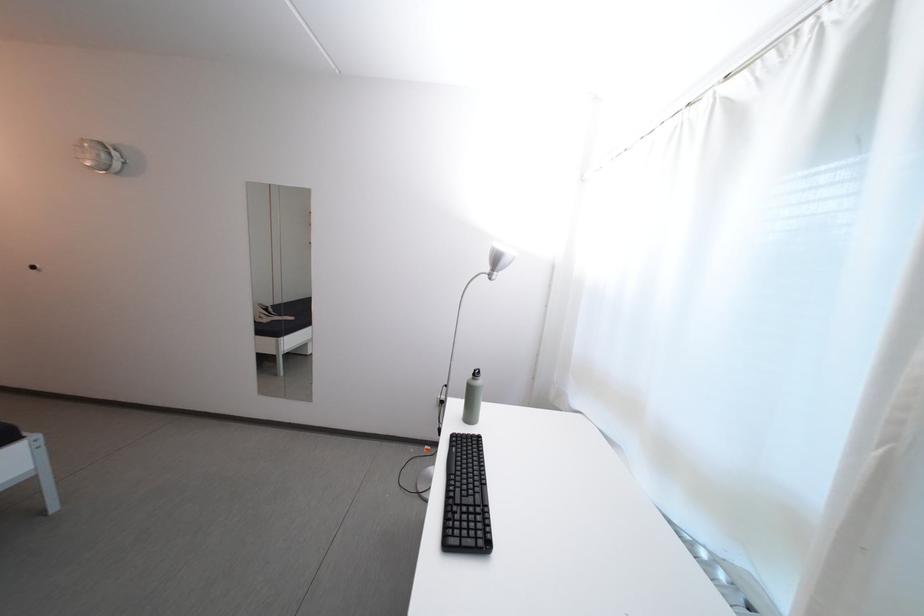
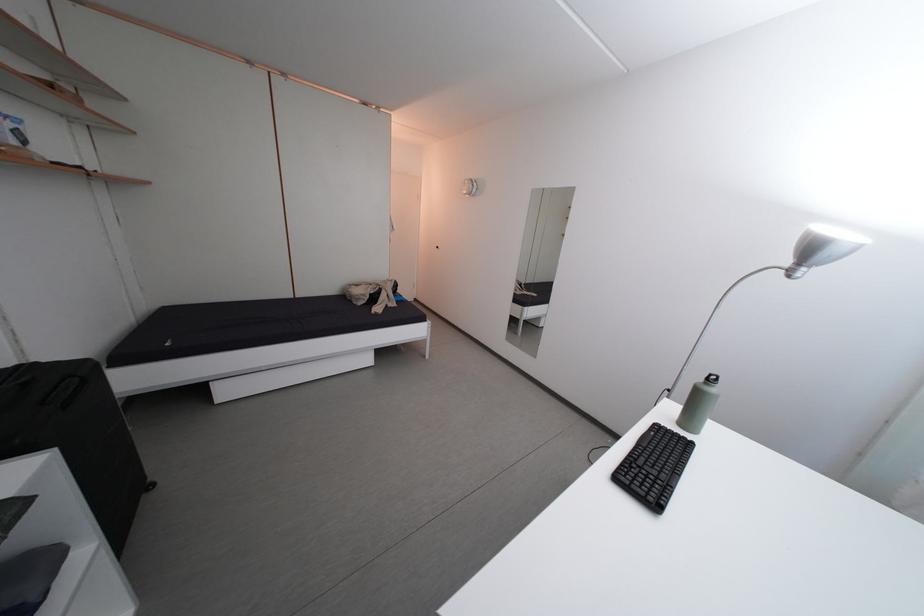
Locate, in the second image, the point that corresponds to point (480, 382) in the first image.

(712, 386)